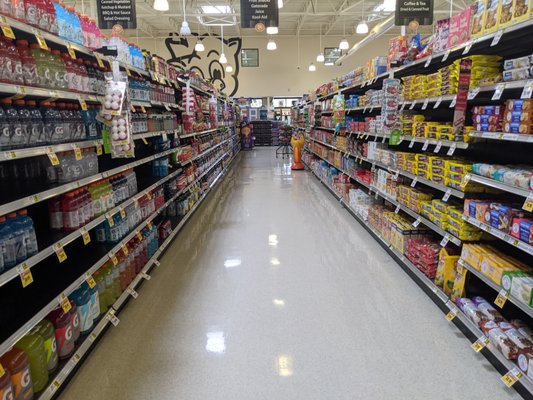
You are a GUI agent. You are given a task and a screenshot of the screen. Output one action in this format:
    pyautogui.click(x=<x>, y=<y>)
    Task: Click on the beige wall
    This screenshot has height=400, width=533.
    Given the screenshot: What is the action you would take?
    pyautogui.click(x=262, y=77)